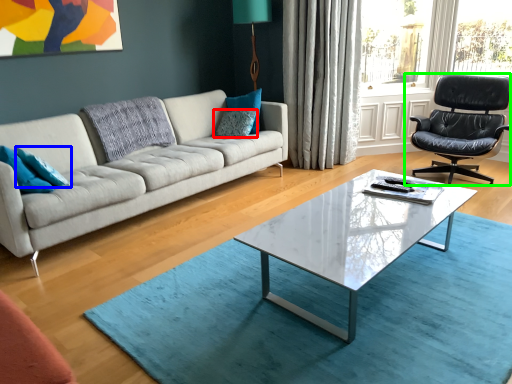
Question: Which is farther away from pillow (highlighted by a red box)? pillow (highlighted by a blue box) or chair (highlighted by a green box)?

Choices:
 (A) pillow
 (B) chair

Answer: (B)